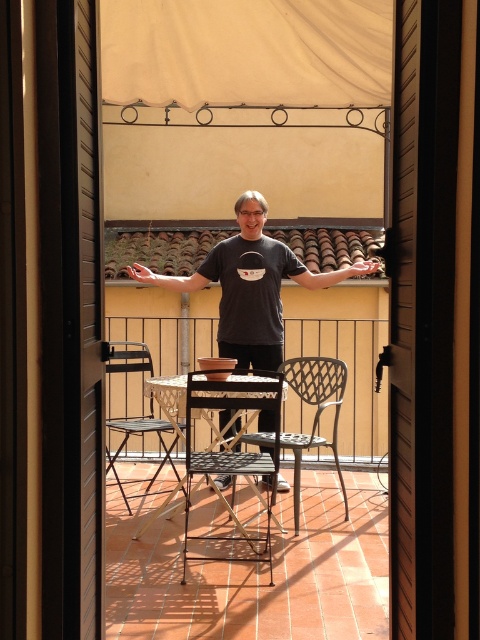
You are planning to hang a large decorative banner that requires a wide space. Based on the scene, which object between the beige fabric canopy at upper center and the metallic black chair at center would be more suitable to place the banner on or near, considering their widths?

The beige fabric canopy at upper center is wider than the metallic black chair at center, making it a better option for hanging the large decorative banner due to its greater width.

You are standing in the doorway and want to place a new chair exactly where the metallic black table at center is currently located. Is this possible without moving the existing table?

The metallic black table at center is already occupying the position at point (218, 436), so placing a new chair there would require moving the existing table first.

You are planning to install a new lighting fixture in the balcony. The beige fabric canopy at upper center and the metallic black chair at center are in the way. Which object should you move first to create space for the new fixture?

The beige fabric canopy at upper center should be moved first because it has a larger size compared to the metallic black chair at center, making it the bigger obstruction.